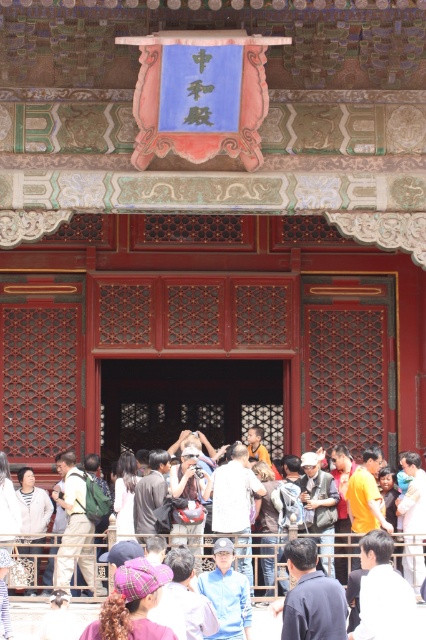
Which is more to the right, plaid fabric headscarf at lower center or white cotton shirt at center?

Positioned to the right is plaid fabric headscarf at lower center.

Is point (115, 596) less distant than point (129, 452)?

Yes, point (115, 596) is closer to viewer.

Identify the location of plaid fabric headscarf at lower center. Image resolution: width=426 pixels, height=640 pixels. (132, 604).

Describe the element at coordinates (32, 509) in the screenshot. This screenshot has width=426, height=640. I see `white fuzzy jacket at lower left` at that location.

Does white fuzzy jacket at lower left lie in front of white cotton shirt at center?

No, white fuzzy jacket at lower left is further to the viewer.

Does point (26, 513) come in front of point (129, 465)?

No, it is behind (129, 465).

Image resolution: width=426 pixels, height=640 pixels. In order to click on white fuzzy jacket at lower left in this screenshot , I will do `click(32, 509)`.

Between plaid fabric headscarf at lower center and white fuzzy jacket at lower left, which one is positioned higher?

Positioned higher is white fuzzy jacket at lower left.

Who is lower down, plaid fabric headscarf at lower center or white fuzzy jacket at lower left?

plaid fabric headscarf at lower center is lower down.

Is point (109, 628) farther from viewer compared to point (48, 497)?

No, (109, 628) is closer to viewer.

Find the location of `plaid fabric headscarf at lower center`. plaid fabric headscarf at lower center is located at coordinates (132, 604).